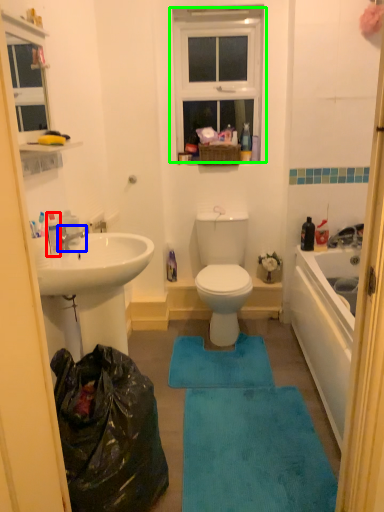
Question: Estimate the real-world distances between objects in this image. Which object is closer to toiletry (highlighted by a red box), tap (highlighted by a blue box) or window (highlighted by a green box)?

Choices:
 (A) tap
 (B) window

Answer: (A)